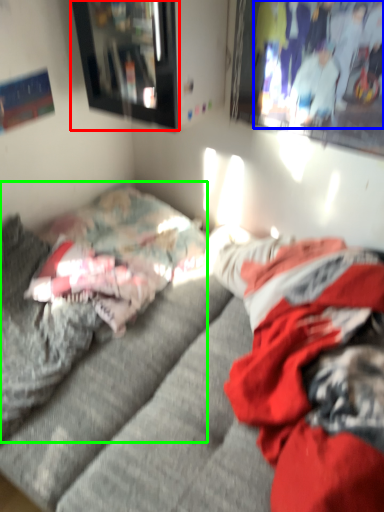
Question: Considering the real-world distances, which object is closest to picture frame (highlighted by a red box)? couple (highlighted by a blue box) or bed (highlighted by a green box).

Choices:
 (A) couple
 (B) bed

Answer: (A)